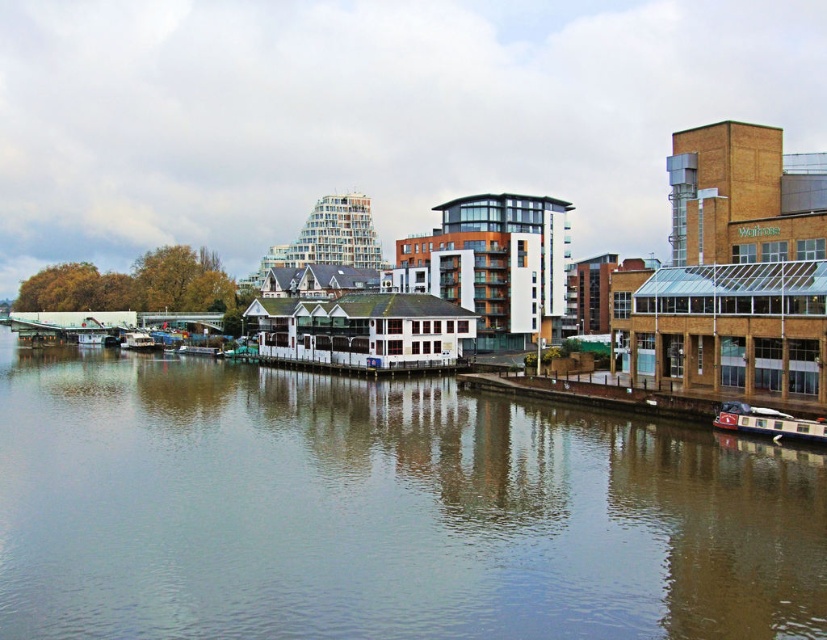
Question: Does brown water at center appear over metallic silver boat at left?

Choices:
 (A) yes
 (B) no

Answer: (B)

Question: Among these points, which one is nearest to the camera?

Choices:
 (A) (719, 422)
 (B) (151, 348)

Answer: (A)

Question: Which object is the farthest from the brown water at center?

Choices:
 (A) red polished wood boat at lower right
 (B) metallic silver boat at left

Answer: (B)

Question: Does brown water at center appear on the right side of red polished wood boat at lower right?

Choices:
 (A) no
 (B) yes

Answer: (A)

Question: Is brown water at center behind red polished wood boat at lower right?

Choices:
 (A) no
 (B) yes

Answer: (A)

Question: Which of the following is the closest to the observer?

Choices:
 (A) (132, 337)
 (B) (720, 424)

Answer: (B)